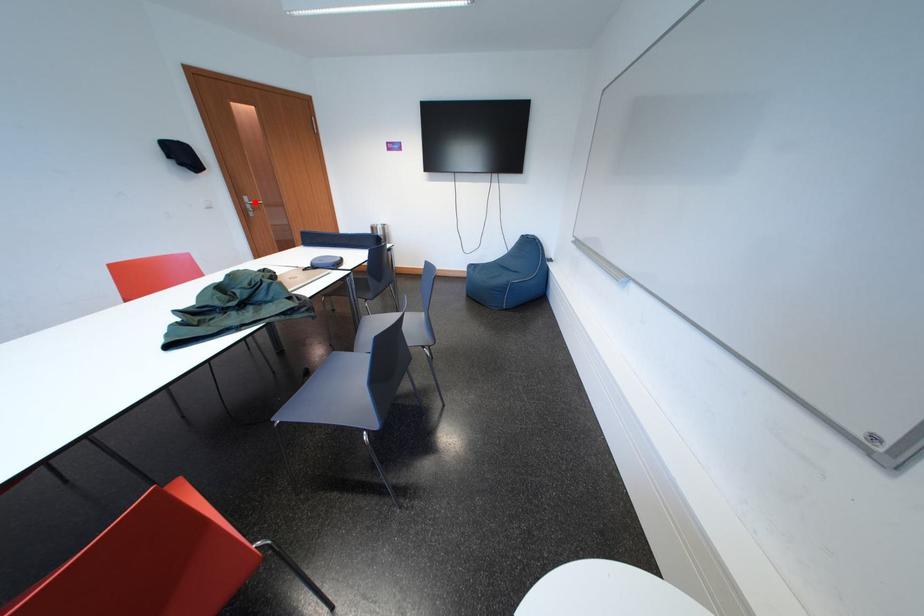
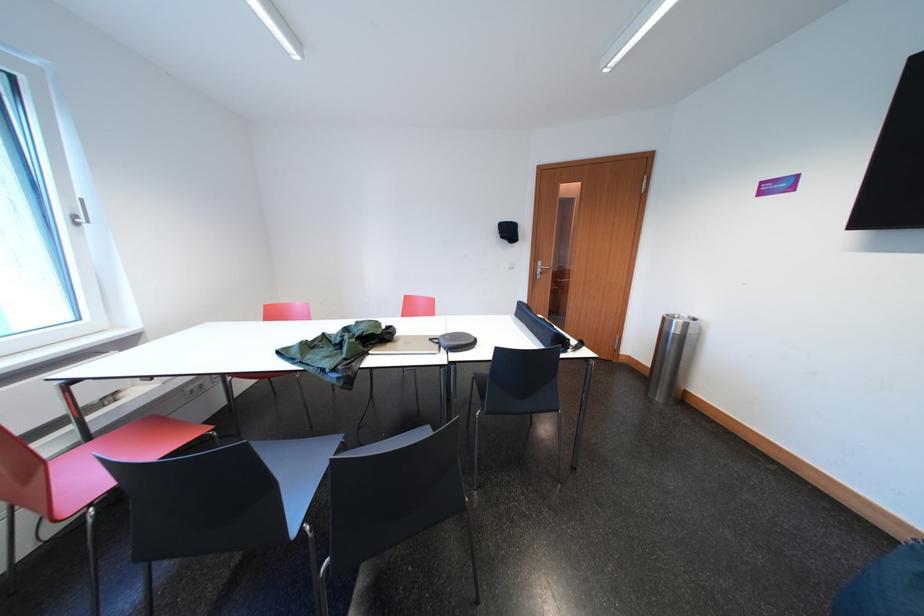
In the second image, find the point that corresponds to the highlighted location in the first image.

(550, 268)